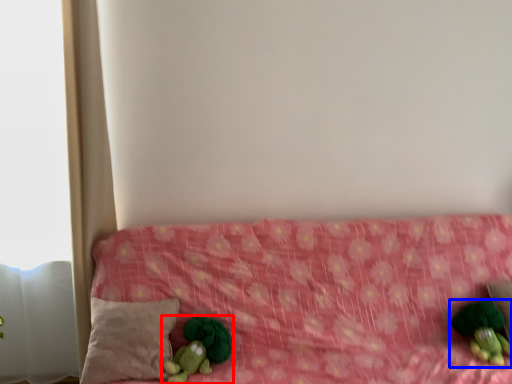
Question: Which point is further to the camera, toy (highlighted by a red box) or toy (highlighted by a blue box)?

Choices:
 (A) toy
 (B) toy

Answer: (B)